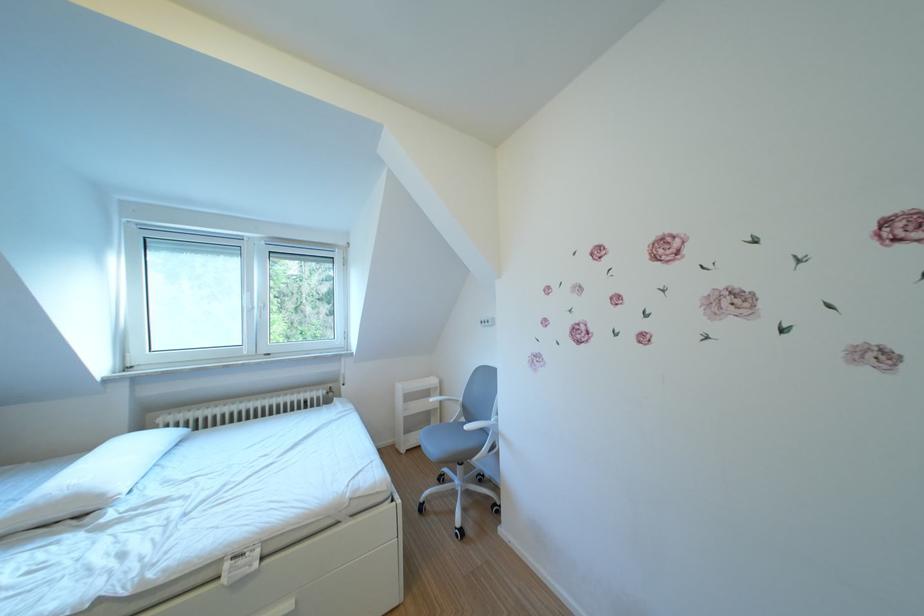
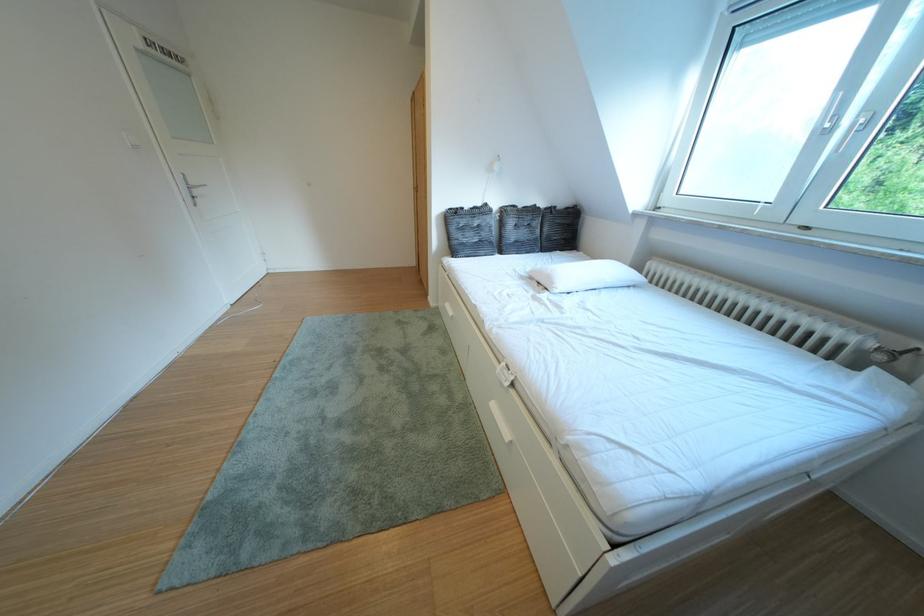
In the second image, find the point that corresponds to [345,400] in the first image.

(893, 363)